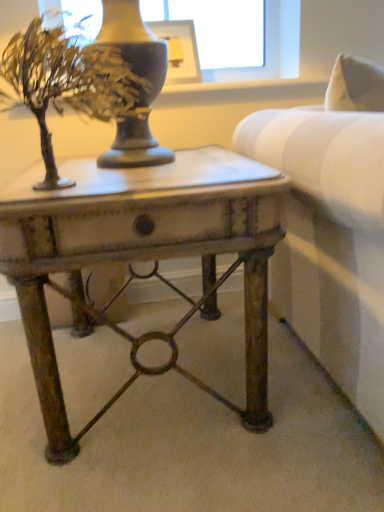
This screenshot has height=512, width=384. In order to click on vacant space to the right of metallic gold tree at upper left in this screenshot , I will do `click(198, 165)`.